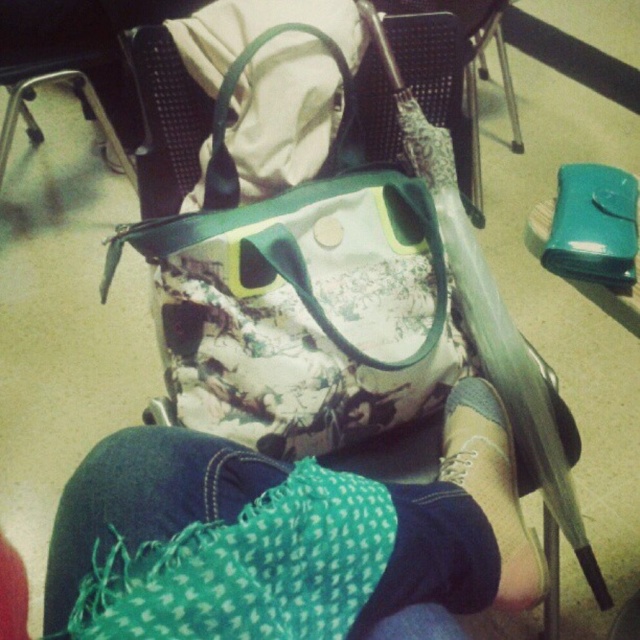
Question: Which point is farther to the camera?

Choices:
 (A) (417, 496)
 (B) (456, 406)

Answer: (B)

Question: Is green knitted scarf at lower center closer to camera compared to suede gray shoe at lower center?

Choices:
 (A) no
 (B) yes

Answer: (B)

Question: Which object appears farthest from the camera in this image?

Choices:
 (A) suede gray shoe at lower center
 (B) green knitted scarf at lower center

Answer: (A)

Question: Is green knitted scarf at lower center to the right of suede gray shoe at lower center from the viewer's perspective?

Choices:
 (A) yes
 (B) no

Answer: (B)

Question: Can you confirm if green knitted scarf at lower center is smaller than suede gray shoe at lower center?

Choices:
 (A) yes
 (B) no

Answer: (B)